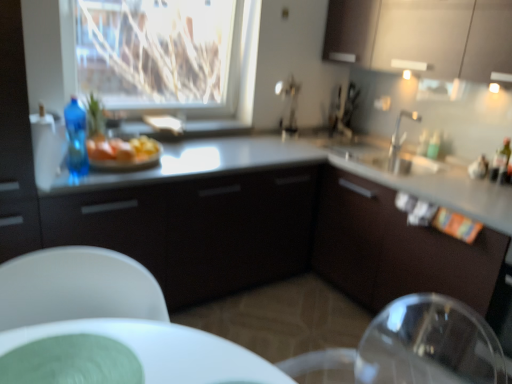
Where is `spots to the right of silver metallic faucet at upper right`? spots to the right of silver metallic faucet at upper right is located at coordinates (429, 163).